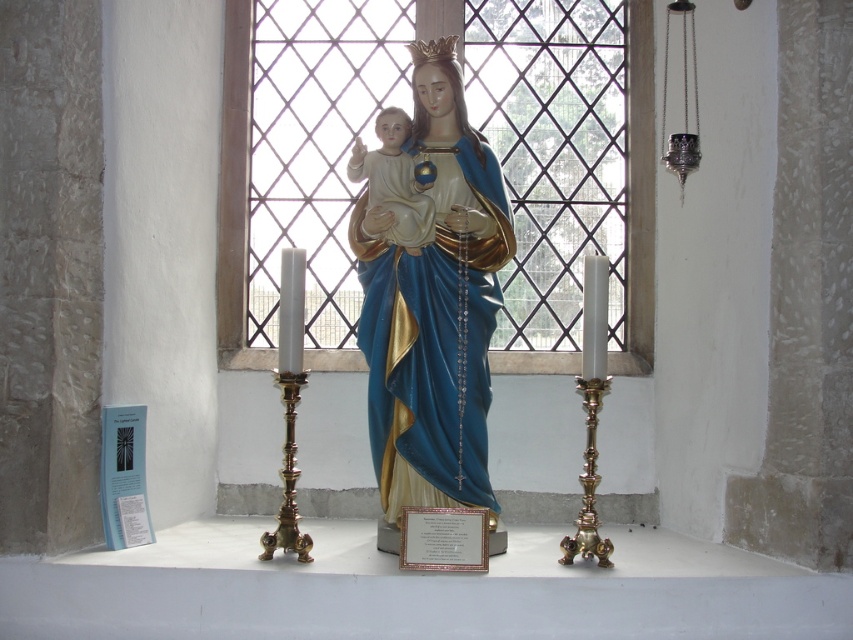
Question: Which point is closer to the camera?

Choices:
 (A) (384, 349)
 (B) (389, 234)

Answer: (A)

Question: Is the position of clear glass window at center less distant than that of matte blue statue at center?

Choices:
 (A) yes
 (B) no

Answer: (B)

Question: Which point is closer to the camera taking this photo?

Choices:
 (A) (410, 225)
 (B) (430, 392)

Answer: (B)

Question: Which object is the closest to the clear glass window at center?

Choices:
 (A) matte porcelain baby at center
 (B) matte blue statue at center

Answer: (B)

Question: Is matte blue statue at center to the right of matte porcelain baby at center from the viewer's perspective?

Choices:
 (A) no
 (B) yes

Answer: (B)

Question: Does clear glass window at center appear under matte blue statue at center?

Choices:
 (A) yes
 (B) no

Answer: (B)